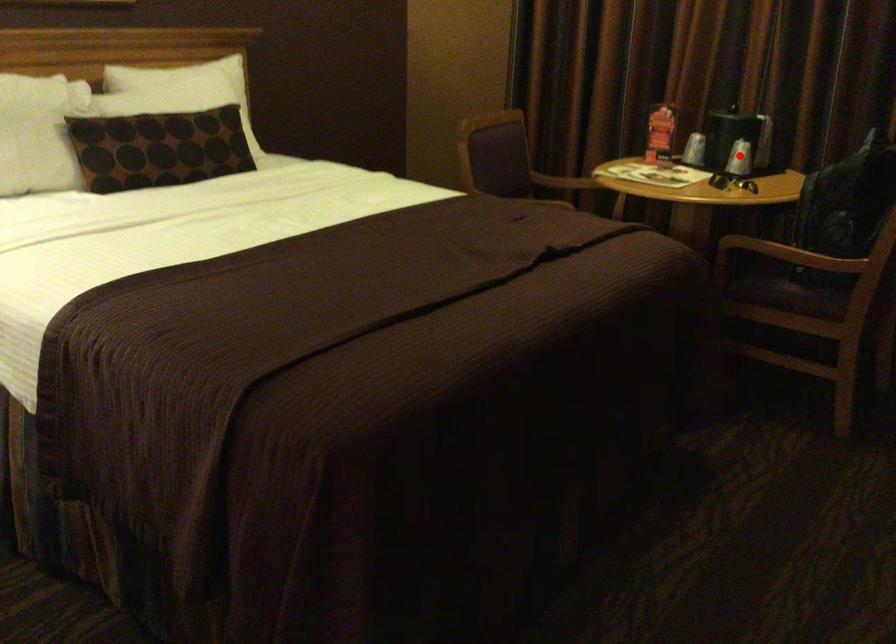
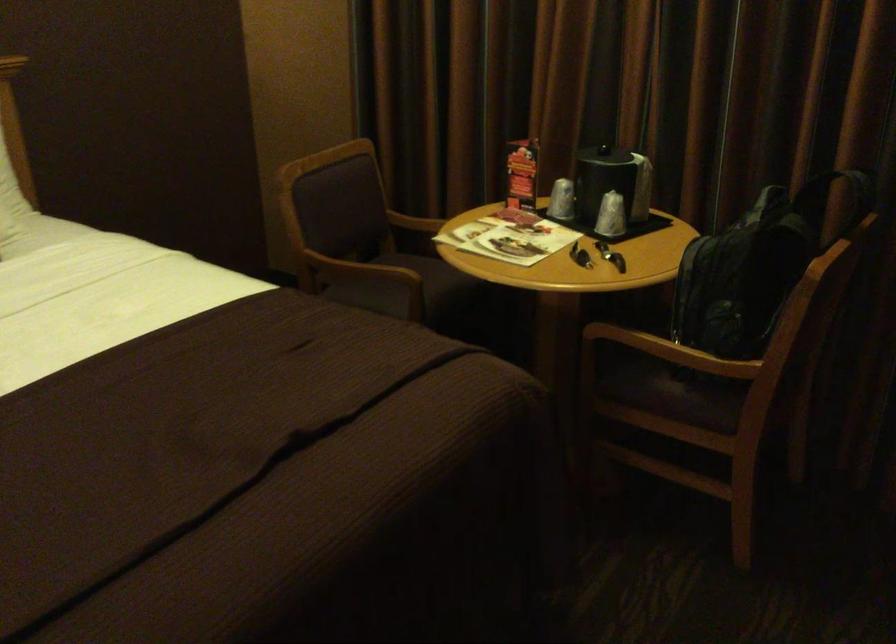
The point at the highlighted location is marked in the first image. Where is the corresponding point in the second image?

(610, 216)